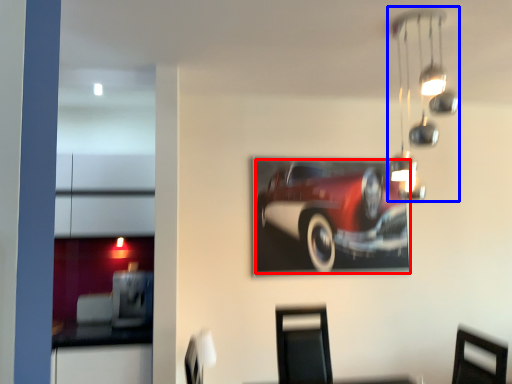
Question: Which object is closer to the camera taking this photo, car (highlighted by a red box) or lamp (highlighted by a blue box)?

Choices:
 (A) car
 (B) lamp

Answer: (B)